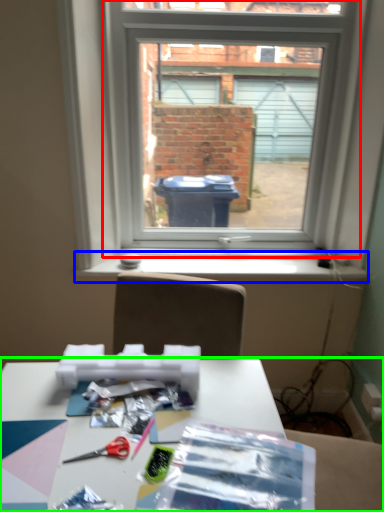
Question: Which object is the farthest from window (highlighted by a red box)? Choose among these: window sill (highlighted by a blue box) or table (highlighted by a green box).

Choices:
 (A) window sill
 (B) table

Answer: (B)